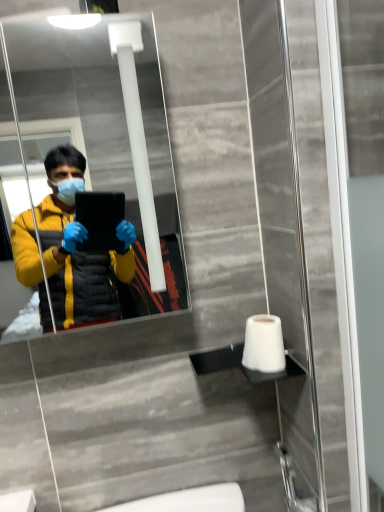
Question: Should I look upward or downward to see matte black mirror at upper center?

Choices:
 (A) down
 (B) up

Answer: (B)

Question: Considering the relative sizes of transparent glass screen door at right and white matte toilet paper at lower right in the image provided, is transparent glass screen door at right bigger than white matte toilet paper at lower right?

Choices:
 (A) yes
 (B) no

Answer: (A)

Question: Does transparent glass screen door at right lie behind white matte toilet paper at lower right?

Choices:
 (A) no
 (B) yes

Answer: (A)

Question: From a real-world perspective, is transparent glass screen door at right over white matte toilet paper at lower right?

Choices:
 (A) no
 (B) yes

Answer: (B)

Question: Is transparent glass screen door at right positioned beyond the bounds of white matte toilet paper at lower right?

Choices:
 (A) no
 (B) yes

Answer: (B)

Question: Is white matte toilet paper at lower right surrounded by transparent glass screen door at right?

Choices:
 (A) yes
 (B) no

Answer: (B)

Question: Is transparent glass screen door at right at the right side of white matte toilet paper at lower right?

Choices:
 (A) yes
 (B) no

Answer: (A)

Question: Could you tell me if matte black mirror at upper center is facing transparent glass screen door at right?

Choices:
 (A) no
 (B) yes

Answer: (A)

Question: Is the position of matte black mirror at upper center more distant than that of transparent glass screen door at right?

Choices:
 (A) yes
 (B) no

Answer: (A)

Question: Considering the relative positions of matte black mirror at upper center and transparent glass screen door at right in the image provided, is matte black mirror at upper center in front of transparent glass screen door at right?

Choices:
 (A) yes
 (B) no

Answer: (B)

Question: From the image's perspective, is matte black mirror at upper center located above transparent glass screen door at right?

Choices:
 (A) yes
 (B) no

Answer: (A)

Question: Does matte black mirror at upper center have a lesser width compared to transparent glass screen door at right?

Choices:
 (A) no
 (B) yes

Answer: (A)

Question: Is matte black mirror at upper center bigger than transparent glass screen door at right?

Choices:
 (A) no
 (B) yes

Answer: (B)

Question: Considering the relative sizes of white matte toilet paper at lower right and matte black mirror at upper center in the image provided, is white matte toilet paper at lower right wider than matte black mirror at upper center?

Choices:
 (A) no
 (B) yes

Answer: (A)